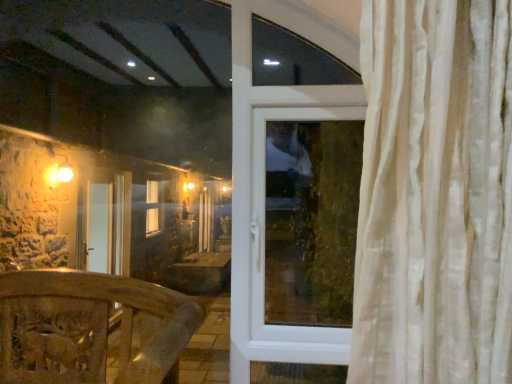
Question: Is transparent glass window at center at the right side of wooden carved railing at lower left?

Choices:
 (A) yes
 (B) no

Answer: (A)

Question: Are transparent glass window at center and wooden carved railing at lower left making contact?

Choices:
 (A) yes
 (B) no

Answer: (B)

Question: From the image's perspective, would you say transparent glass window at center is positioned over wooden carved railing at lower left?

Choices:
 (A) no
 (B) yes

Answer: (B)

Question: Considering the relative sizes of transparent glass window at center and wooden carved railing at lower left in the image provided, is transparent glass window at center thinner than wooden carved railing at lower left?

Choices:
 (A) yes
 (B) no

Answer: (A)

Question: Does transparent glass window at center have a greater width compared to wooden carved railing at lower left?

Choices:
 (A) no
 (B) yes

Answer: (A)

Question: Is transparent glass window at center shorter than wooden carved railing at lower left?

Choices:
 (A) yes
 (B) no

Answer: (B)

Question: Does wooden carved railing at lower left have a lesser height compared to transparent glass window at center?

Choices:
 (A) no
 (B) yes

Answer: (B)

Question: From the image's perspective, does wooden carved railing at lower left appear higher than transparent glass window at center?

Choices:
 (A) yes
 (B) no

Answer: (B)

Question: Is transparent glass window at center surrounded by wooden carved railing at lower left?

Choices:
 (A) yes
 (B) no

Answer: (B)

Question: Considering the relative positions of wooden carved railing at lower left and transparent glass window at center in the image provided, is wooden carved railing at lower left to the right of transparent glass window at center from the viewer's perspective?

Choices:
 (A) no
 (B) yes

Answer: (A)

Question: Is wooden carved railing at lower left bigger than transparent glass window at center?

Choices:
 (A) yes
 (B) no

Answer: (A)

Question: Is wooden carved railing at lower left to the left of transparent glass window at center from the viewer's perspective?

Choices:
 (A) no
 (B) yes

Answer: (B)

Question: Considering the positions of point (308, 210) and point (125, 304), is point (308, 210) closer or farther from the camera than point (125, 304)?

Choices:
 (A) closer
 (B) farther

Answer: (B)